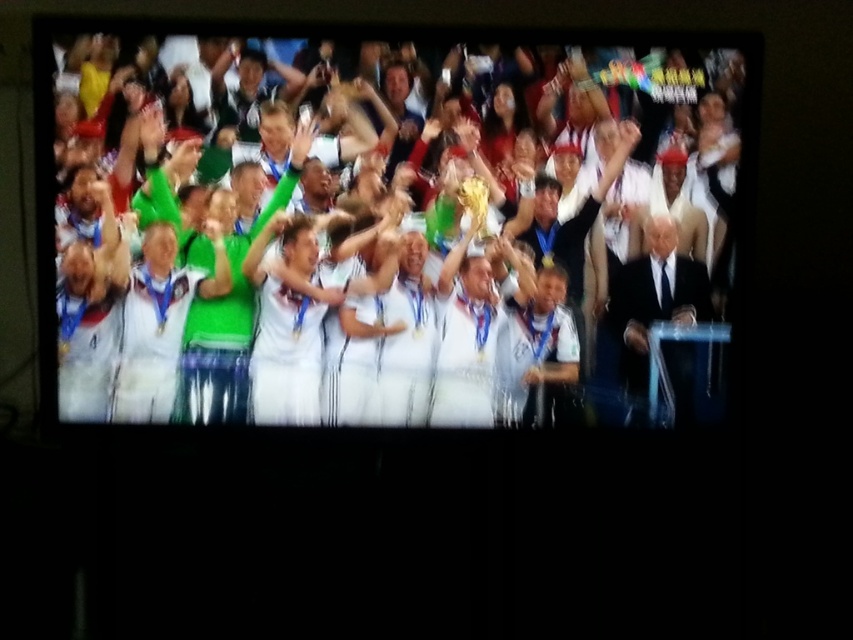
Question: Which of the following is the farthest from the observer?

Choices:
 (A) tap(483, 193)
 (B) tap(335, 156)
 (C) tap(688, 403)

Answer: (A)

Question: Can you confirm if white jersey trophy at center is smaller than black suit at right?

Choices:
 (A) yes
 (B) no

Answer: (B)

Question: Which object is closer to the camera taking this photo?

Choices:
 (A) black suit at right
 (B) white jersey trophy at center

Answer: (B)

Question: Which point is closer to the camera?

Choices:
 (A) black suit at right
 (B) white jersey trophy at center
 (C) gold shiny trophy at center

Answer: (B)

Question: Does black suit at right have a greater width compared to gold shiny trophy at center?

Choices:
 (A) no
 (B) yes

Answer: (B)

Question: Can you confirm if black suit at right is positioned to the left of gold shiny trophy at center?

Choices:
 (A) no
 (B) yes

Answer: (A)